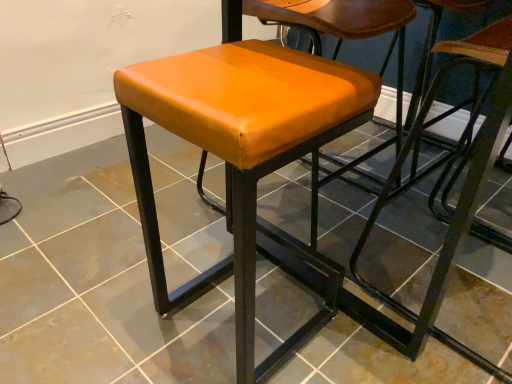
This screenshot has height=384, width=512. In order to click on free space to the left of orange leather stool at center in this screenshot , I will do `click(117, 314)`.